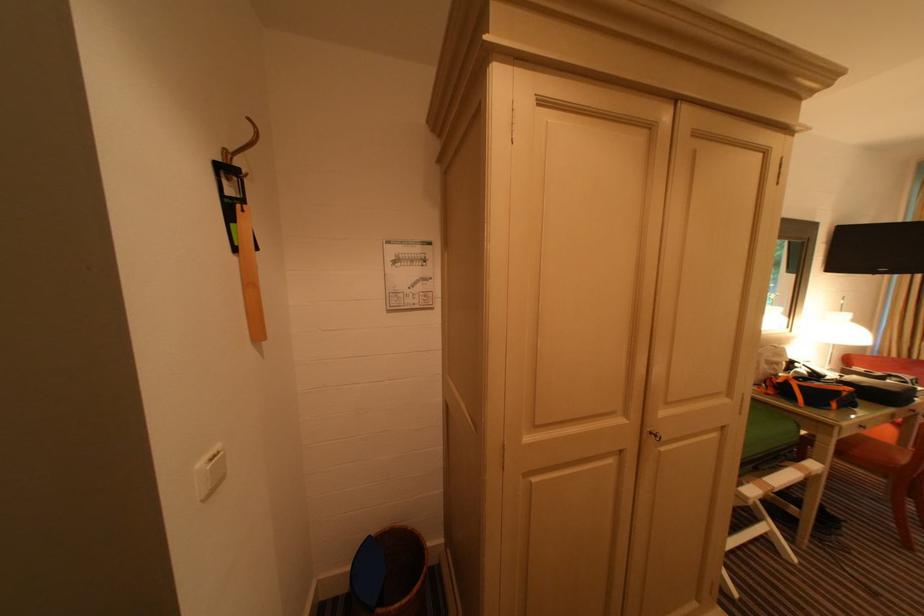
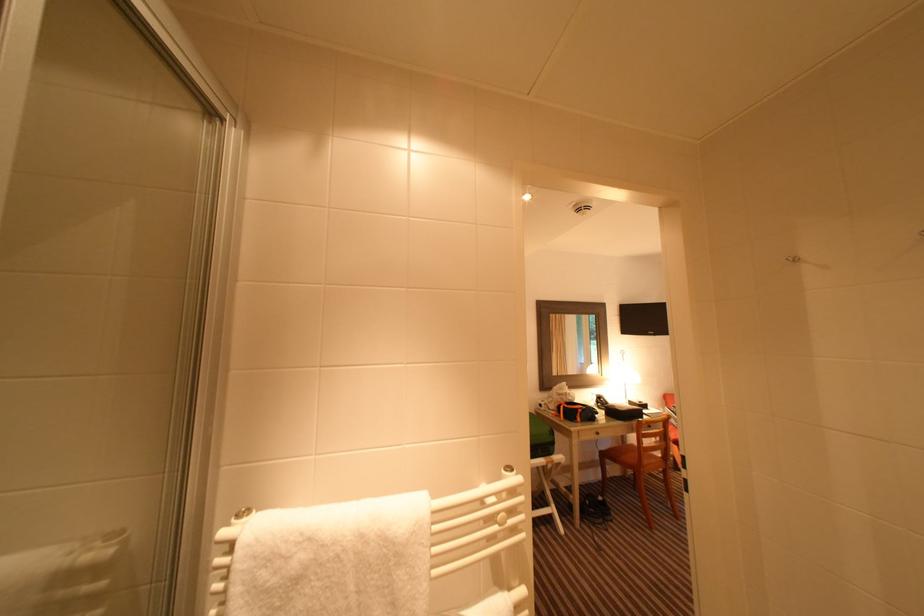
What movement of the cameraman would produce the second image?

The movement direction of the cameraman is right, backward.